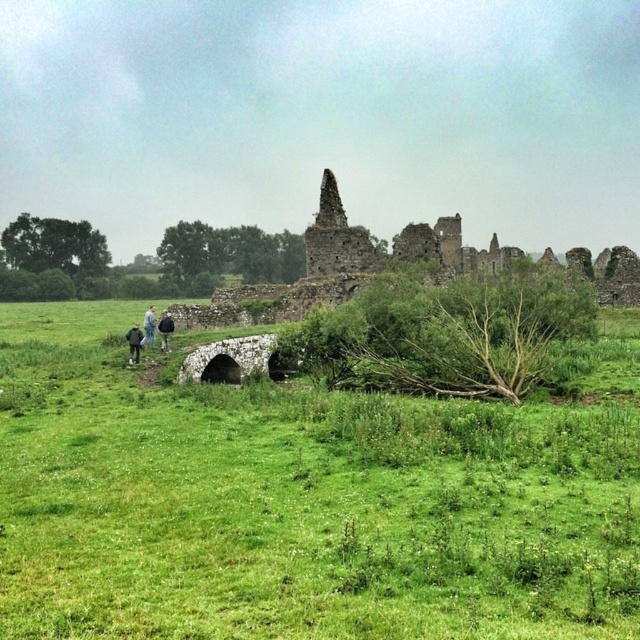
You are standing at the point with coordinates point (163,346) and want to walk towards the large stone ruin in the background. Which direction should you head to avoid the point (538,516)?

Since point (538,516) is in front of point (163,346), you should head in a direction that goes around it, either to the left or right to avoid it while moving towards the large stone ruin in the background.